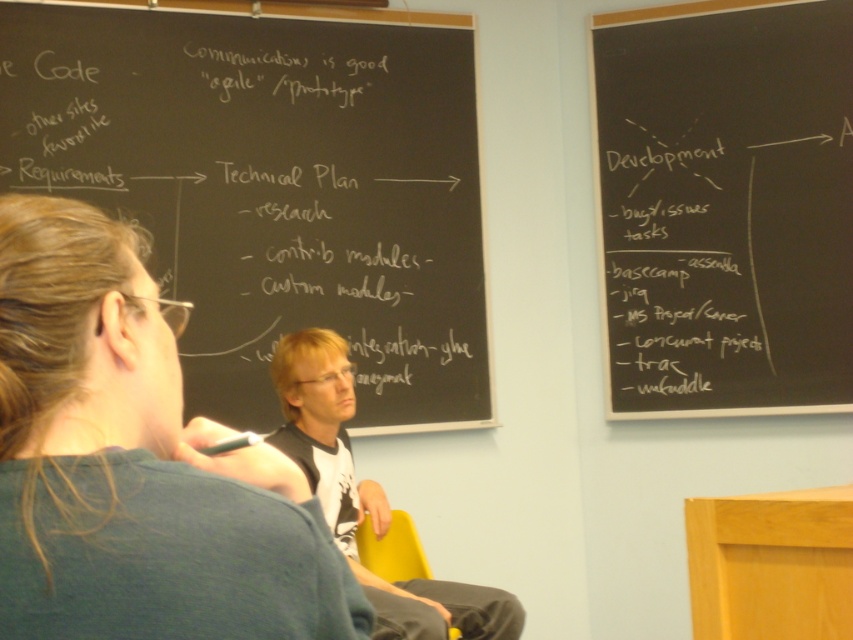
You are a student sitting in the classroom and want to refer to the white chalkboard at upper right while listening to the person in the dark blue shirt at center. Which one is physically closer to your left side?

The dark blue shirt at center is on the left side of the white chalkboard at upper right, so the dark blue shirt at center is closer to your left side.